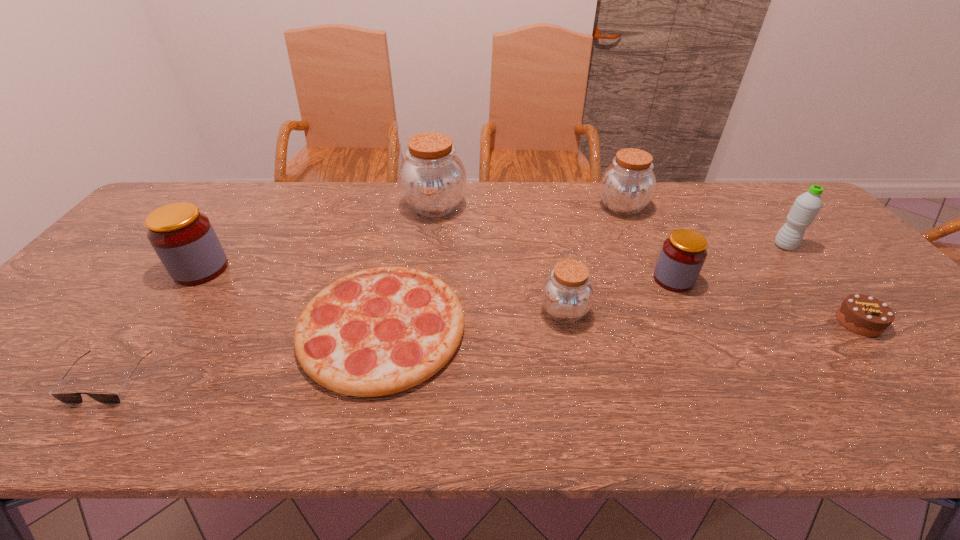
Find the location of `empty location between the leftmost jar and the tallest jar`. empty location between the leftmost jar and the tallest jar is located at coordinates (318, 238).

Image resolution: width=960 pixels, height=540 pixels. I want to click on free area in between the bigger red jar and the third shortest object, so click(x=530, y=295).

Locate an element on the screen. This screenshot has width=960, height=540. vacant point located between the green water bottle and the left red jar is located at coordinates (492, 258).

Identify the location of free space between the smaller red jar and the pizza. (528, 304).

In order to click on free space between the sunglasses and the leftmost jar in this screenshot , I will do `click(156, 324)`.

What are the coordinates of `blank region between the right red jar and the smallest brown jar` in the screenshot? It's located at (619, 295).

Where is `unoccupied position between the second smallest brown jar and the pizza`? The height and width of the screenshot is (540, 960). unoccupied position between the second smallest brown jar and the pizza is located at coordinates (502, 268).

The image size is (960, 540). I want to click on free space between the biggest brown jar and the second brown jar from left to right, so click(x=499, y=259).

The width and height of the screenshot is (960, 540). I want to click on free space between the brown chocolate cake and the pizza, so click(x=620, y=325).

Find the location of a particular element. The width and height of the screenshot is (960, 540). object that can be found as the fourth closest to the smaller red jar is located at coordinates (862, 314).